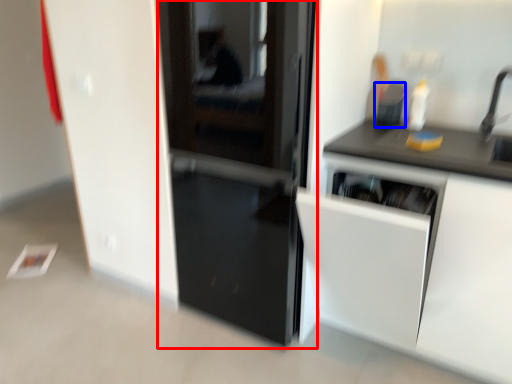
Question: Among these objects, which one is farthest to the camera, door (highlighted by a red box) or appliance (highlighted by a blue box)?

Choices:
 (A) door
 (B) appliance

Answer: (B)